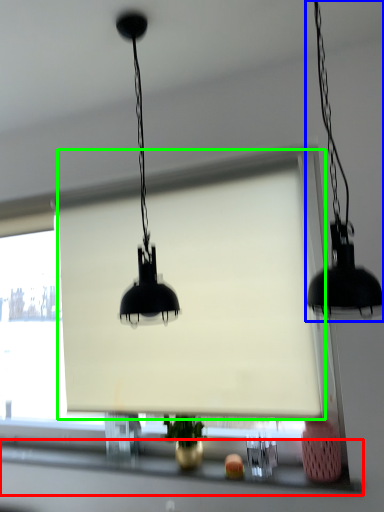
Question: Estimate the real-world distances between objects in this image. Which object is farther from window sill (highlighted by a red box), lamp (highlighted by a blue box) or window screen (highlighted by a green box)?

Choices:
 (A) lamp
 (B) window screen

Answer: (A)